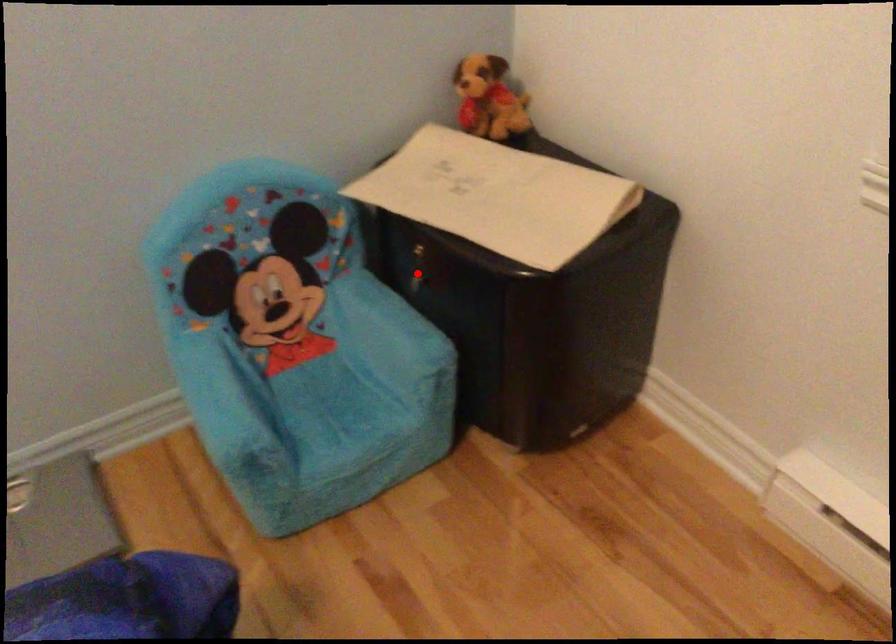
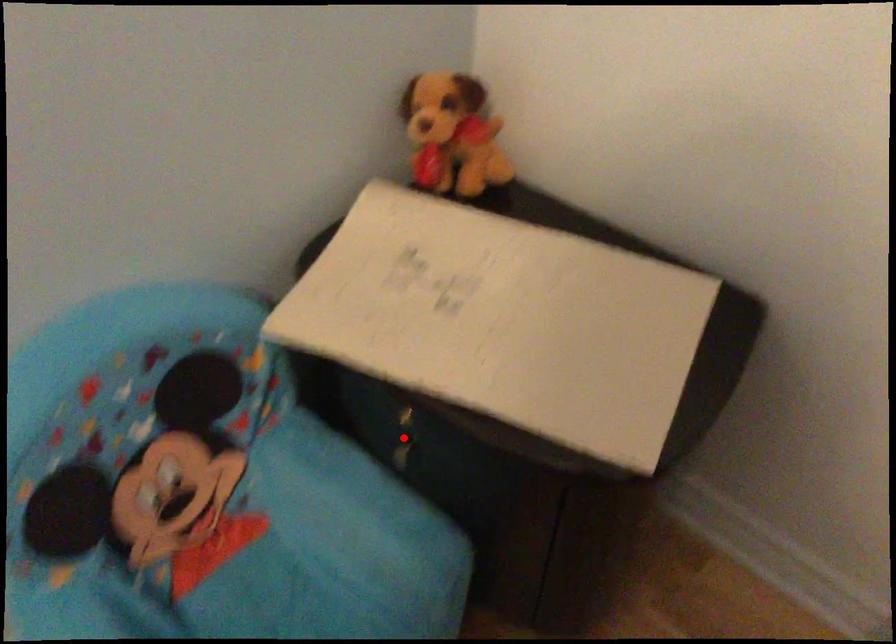
I am providing you with two images of the same scene from different viewpoints. A red point is marked on the first image and another point is marked on the second image. Does the point marked in image1 correspond to the same location as the one in image2?

Yes